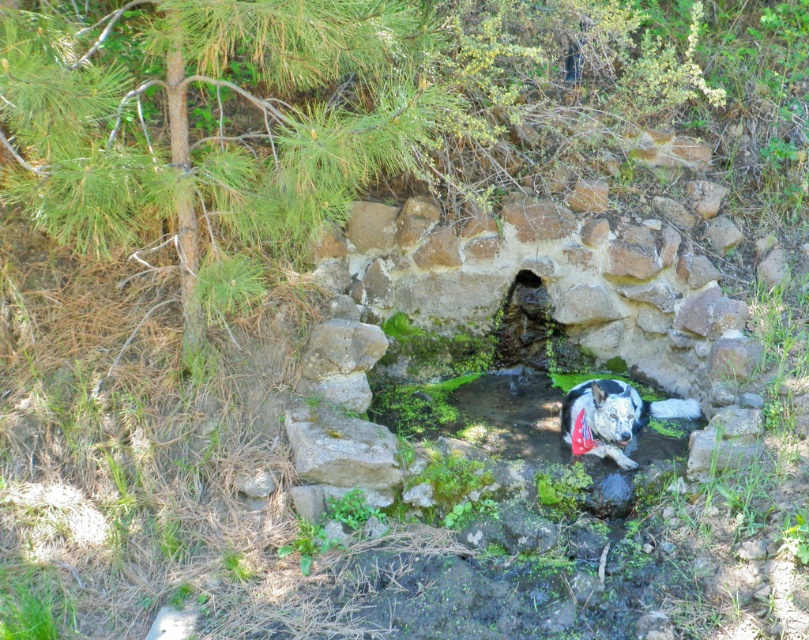
You are standing at the edge of the water feature and want to place a small decorative rock between the green leafy tree at upper left and the green mossy stone at center. Based on their widths, which object should you use as a reference point to ensure the rock fits properly?

The green leafy tree at upper left might be wider than the green mossy stone at center, so you should use the green leafy tree at upper left as the reference point to ensure the decorative rock fits properly between them.

You are standing in the woods and see the green leafy tree at upper left and the green mossy stone at center. Which object is closer to you based on their positions?

The green leafy tree at upper left is closer to you because it is in front of the green mossy stone at center.

In the scene shown: You are standing in front of the water feature and want to place a small decorative stone. You have two options for placement locations marked as point 1 at coordinates point (x=428, y=84) and point 2 at coordinates point (x=523, y=296). Which point is closer to you?

Point (x=428, y=84) is closer to you than point (x=523, y=296).